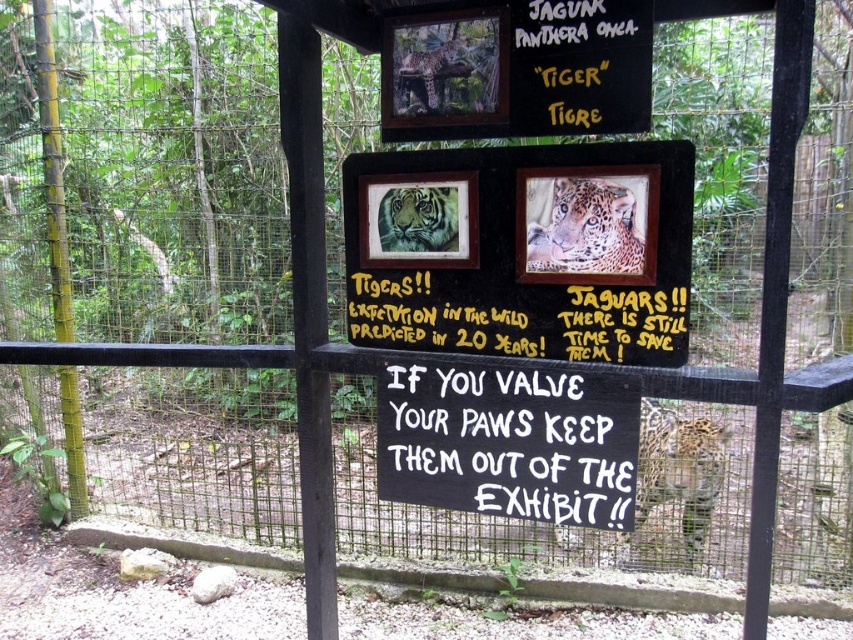
Question: Which point is closer to the camera taking this photo?

Choices:
 (A) [550, 204]
 (B) [410, 240]
 (C) [699, 436]
 (D) [456, 241]

Answer: (A)

Question: Which object is closer to the camera taking this photo?

Choices:
 (A) brown fur jaguar at upper center
 (B) wooden signboard at center
 (C) spotted fur jaguar at center
 (D) spotted fur leopard at center

Answer: (B)

Question: Can you confirm if black chalkboard at center is thinner than sandy fur tiger at center?

Choices:
 (A) yes
 (B) no

Answer: (B)

Question: Is sandy fur tiger at center above brown fur jaguar at upper center?

Choices:
 (A) yes
 (B) no

Answer: (B)

Question: Does black chalkboard at center have a larger size compared to brown fur jaguar at upper center?

Choices:
 (A) yes
 (B) no

Answer: (A)

Question: Which point is closer to the camera?

Choices:
 (A) spotted fur leopard at center
 (B) brown fur jaguar at upper center
 (C) black chalkboard at center
 (D) sandy fur tiger at center

Answer: (C)